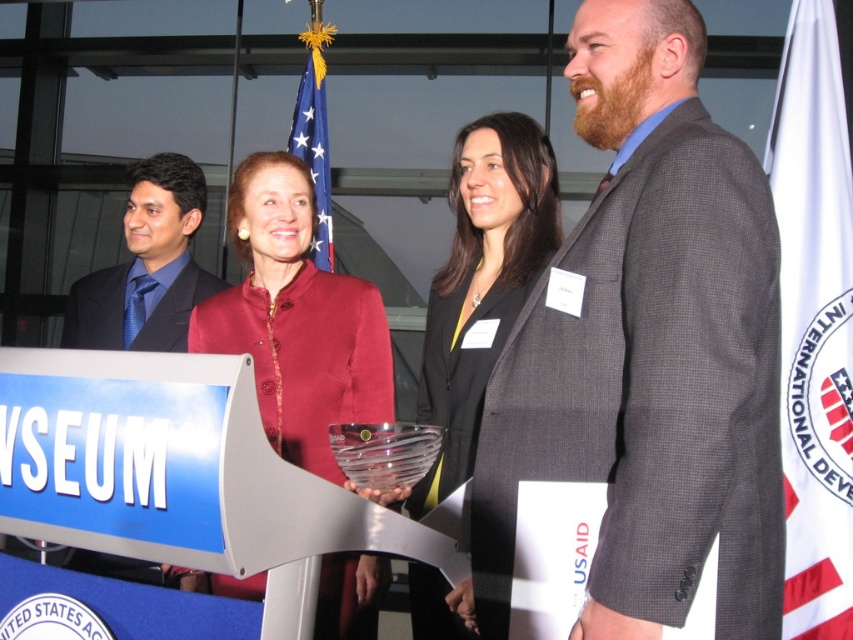
You are a photographer positioned at the center of the scene. You want to capture a photo that includes both the white fabric flag at right and the group of people. Given that your camera has a focal length of 50mm, which is best suited for capturing subjects at a distance of 2 to 3 meters, will this focal length work for including both the group and the flag in the frame?

The white fabric flag at right is 2.53 meters from the camera. Since the focal length of 50mm is suitable for distances between 2 to 3 meters, it should work to include both the group and the flag in the frame.

You are attending a formal event and notice two flags displayed in the background. The white fabric flag at right and the american flag at center. According to proper flag etiquette, which flag should be placed higher than the other? Please explain your reasoning based on their current positions.

According to proper flag etiquette, the American flag should always be placed higher than any other flag. In this case, the white fabric flag at right is positioned under the American flag at center, which aligns with the correct protocol since the American flag is higher.

You are attending a formal event and need to locate the gray checkered suit at center and the american flag at center. Based on the scene description, which object is positioned lower?

The gray checkered suit at center is located below the american flag at center, so the gray checkered suit at center is positioned lower.